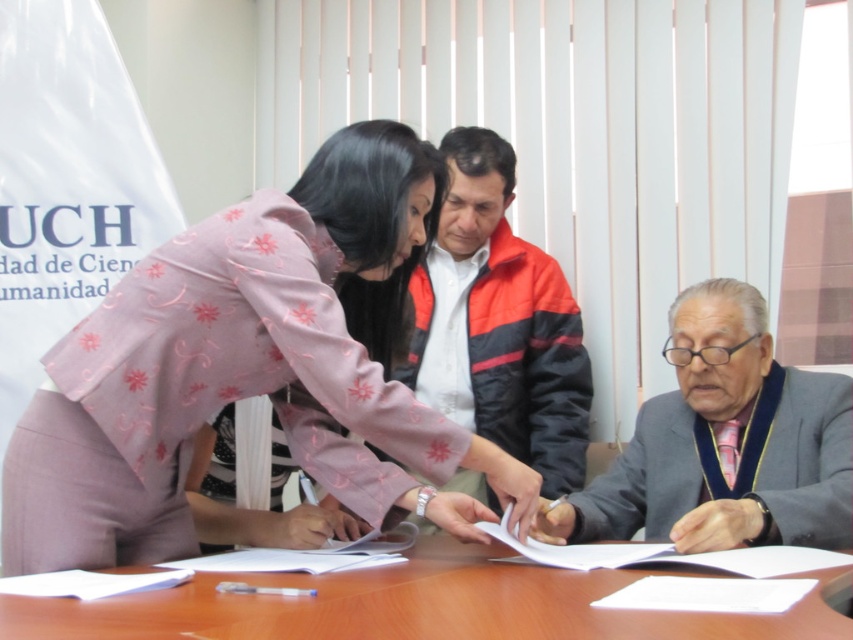
You are an event photographer who needs to capture a candid shot of the woman in the light pink suit with a floral pattern leaning over the table. The camera you are using has a limited field of view. Given that the pink floral fabric at center is represented by point (248, 368), can you determine if the point is within the camera frame?

The pink floral fabric at center is represented by point (248, 368). Since the point is at the center, it is within the camera frame.

From the picture: You are organizing a small event and need to place a 2.5 meter long banner along the edge of the wooden table at center. Considering the gray wool suit at lower right is also on the table, will there be enough space for the banner?

The wooden table at center is wider than the gray wool suit at lower right. However, since the banner is 2.5 meters long, it depends on the table length. The description only mentions width comparison between the two objects, not the table length. Without knowing the table length, we cannot confirm if the banner will fit.

You are organizing a small event and need to determine if the pink floral fabric at center can completely cover the wooden table at center. Based on the scene description, can you confirm if the fabric is large enough?

The pink floral fabric at center has a larger size compared to wooden table at center, so yes, the fabric can completely cover the wooden table at center.